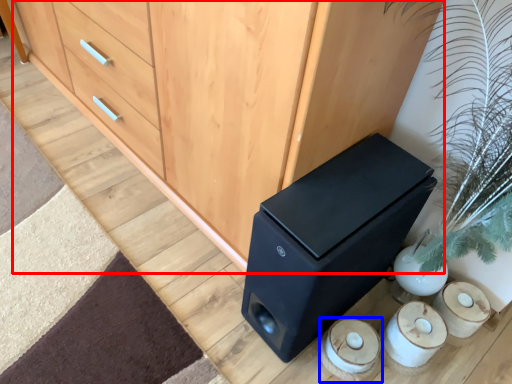
Question: Which object is further to the camera taking this photo, chest of drawers (highlighted by a red box) or candle holder (highlighted by a blue box)?

Choices:
 (A) chest of drawers
 (B) candle holder

Answer: (B)